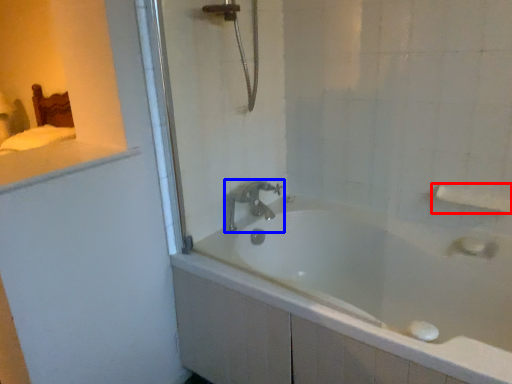
Question: Which point is further to the camera, towel bar (highlighted by a red box) or tap (highlighted by a blue box)?

Choices:
 (A) towel bar
 (B) tap

Answer: (B)